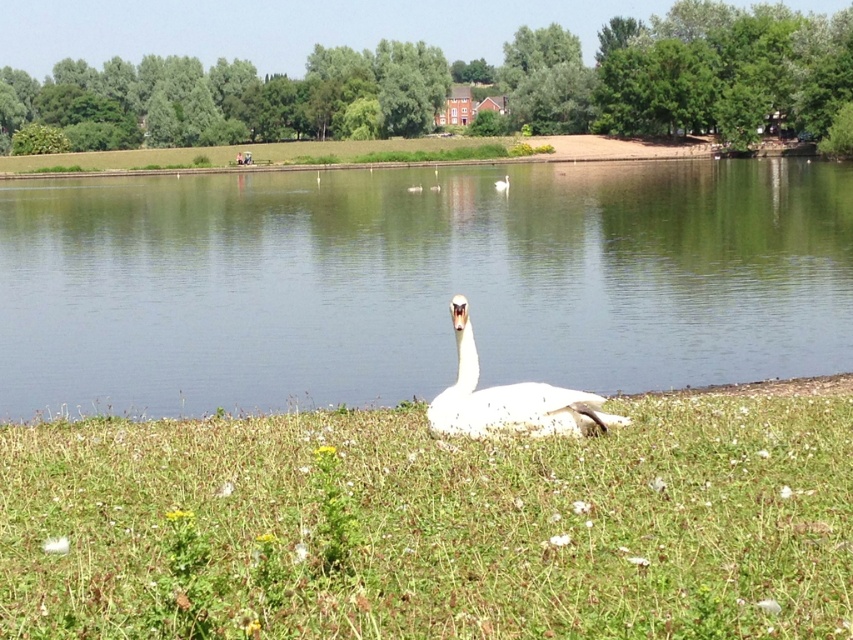
Question: Does clear water at center have a lesser width compared to white matte goose at center?

Choices:
 (A) no
 (B) yes

Answer: (A)

Question: Which point is closer to the camera?

Choices:
 (A) (338, 266)
 (B) (500, 424)
 (C) (645, 456)
 (D) (506, 180)

Answer: (C)

Question: Is white soft grass at center closer to the viewer compared to white glossy swan at center?

Choices:
 (A) yes
 (B) no

Answer: (A)

Question: Which point is closer to the camera taking this photo?

Choices:
 (A) (161, 582)
 (B) (525, 394)
 (C) (265, 356)

Answer: (A)

Question: Is clear water at center further to the viewer compared to white matte goose at center?

Choices:
 (A) yes
 (B) no

Answer: (B)

Question: Among these points, which one is nearest to the camera?

Choices:
 (A) (93, 196)
 (B) (846, 432)
 (C) (473, 422)
 (D) (505, 177)

Answer: (B)